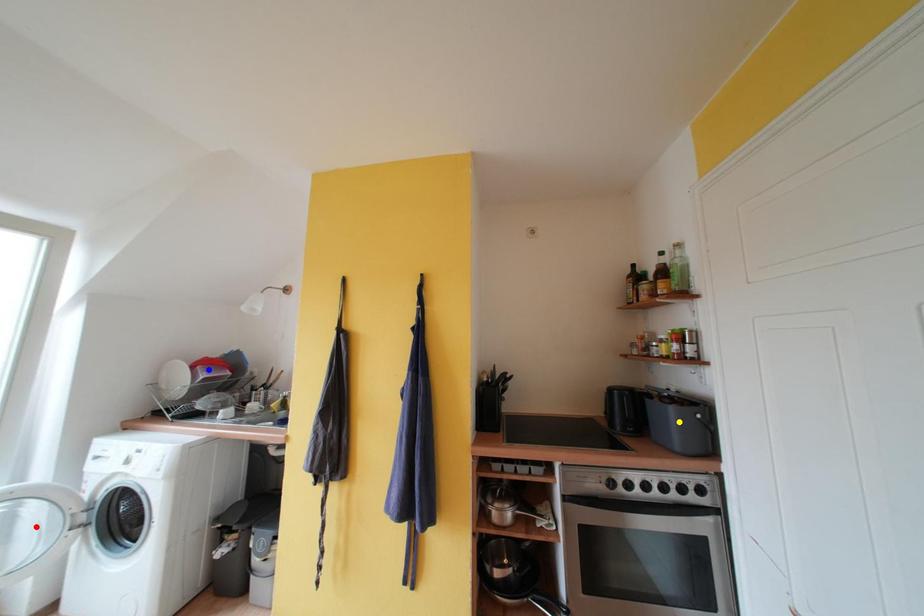
Order these from nearest to farthest:
A) red point
B) blue point
C) yellow point

blue point, yellow point, red point